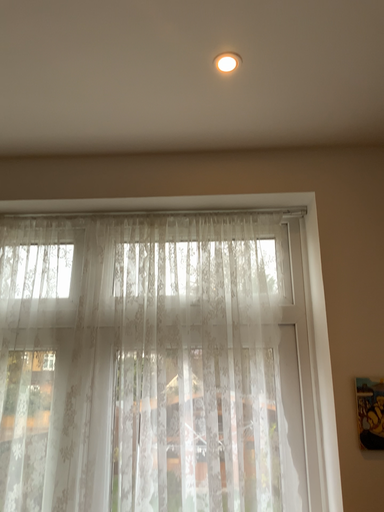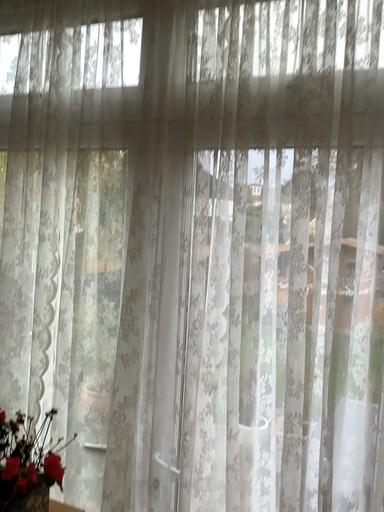
Question: How did the camera likely rotate when shooting the video?

Choices:
 (A) rotated left
 (B) rotated right

Answer: (A)